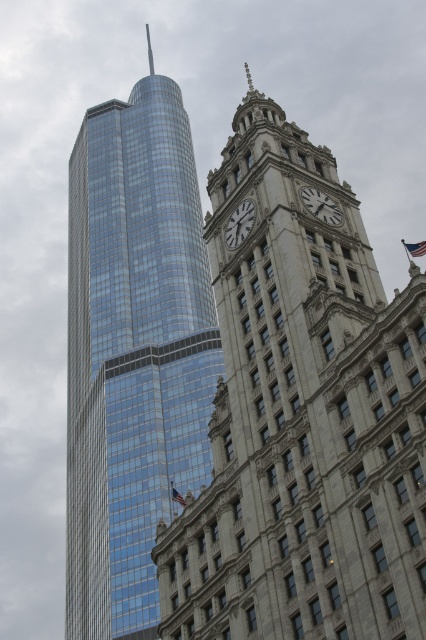
You are standing in front of the two buildings and want to determine which point is closer to you. The points are labeled as point (x=189, y=177) and point (x=328, y=202). Which point is closer to your position?

Point (x=189, y=177) is closer to you than point (x=328, y=202) because it is further to the viewer according to the description.

You are a drone operator planning to fly a drone from the shiny glass skyscraper at left to the white marble clock at upper center. The drone has a maximum flight range of 80 meters. Based on the scene, can the drone reach its destination?

The distance between the shiny glass skyscraper at left and the white marble clock at upper center is 85.35 meters, which exceeds the drone s 80 meter range. Therefore, the drone cannot reach the destination.